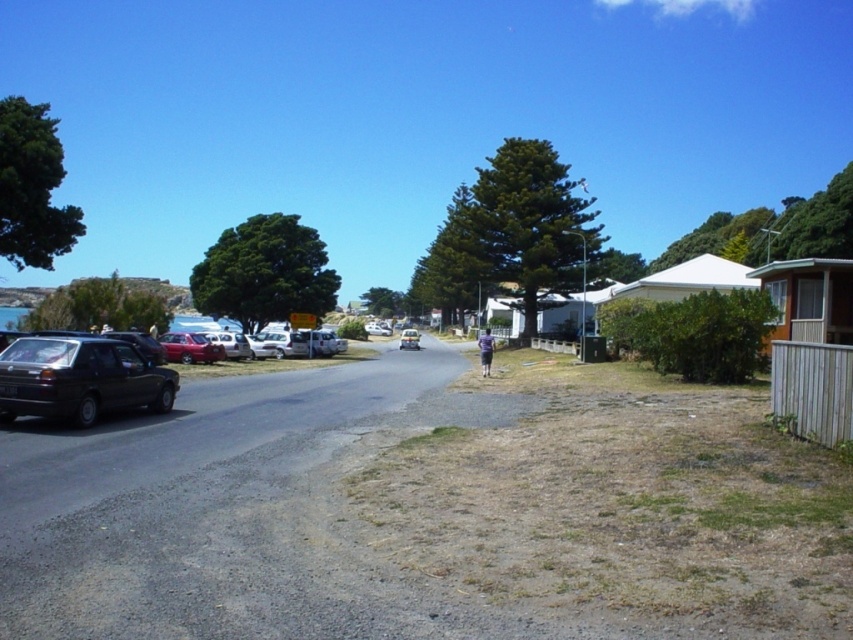
Based on the photo, who is higher up, silver metallic car at center or white matte car at center?

Positioned higher is white matte car at center.

Does silver metallic car at center have a greater width compared to white matte car at center?

No, silver metallic car at center is not wider than white matte car at center.

Who is more forward, (280, 353) or (222, 344)?

→ Point (222, 344)

At what (x,y) coordinates should I click in order to perform the action: click on silver metallic car at center. Please return your answer as a coordinate pair (x, y). Image resolution: width=853 pixels, height=640 pixels. Looking at the image, I should click on (280, 344).

Does matte black car at left have a greater height compared to metallic red car at left?

Yes, matte black car at left is taller than metallic red car at left.

Which is more to the left, matte black car at left or metallic red car at left?

Positioned to the left is metallic red car at left.

Who is more distant from viewer, (100, 388) or (193, 342)?

Positioned behind is point (193, 342).

The height and width of the screenshot is (640, 853). I want to click on matte black car at left, so click(79, 378).

Looking at this image, between white matte car at center and metallic silver car at center, which one appears on the left side from the viewer's perspective?

Positioned to the left is white matte car at center.

At what (x,y) coordinates should I click in order to perform the action: click on white matte car at center. Please return your answer as a coordinate pair (x, y). The width and height of the screenshot is (853, 640). Looking at the image, I should click on (230, 342).